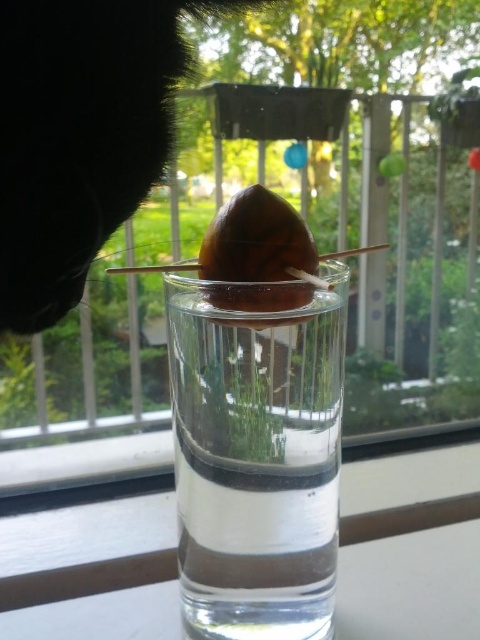
Is point (244, 508) behind point (78, 40)?

No, it is in front of (78, 40).

Looking at this image, which is more to the left, clear glass vase at center or black fur cat at upper left?

Positioned to the left is black fur cat at upper left.

Between point (251, 592) and point (158, 1), which one is positioned behind?

The point (158, 1) is behind.

Identify the location of clear glass vase at center. The image size is (480, 640). (256, 452).

Between point (148, 115) and point (286, 216), which one is positioned in front?

Positioned in front is point (286, 216).

Where is `black fur cat at upper left`? The width and height of the screenshot is (480, 640). black fur cat at upper left is located at coordinates (80, 136).

Looking at this image, does clear glass vase at center appear under brown matte acorn at center?

Yes.

Is point (187, 620) farther from viewer compared to point (278, 205)?

Yes, it is.

What are the coordinates of `clear glass vase at center` in the screenshot? It's located at pos(256,452).